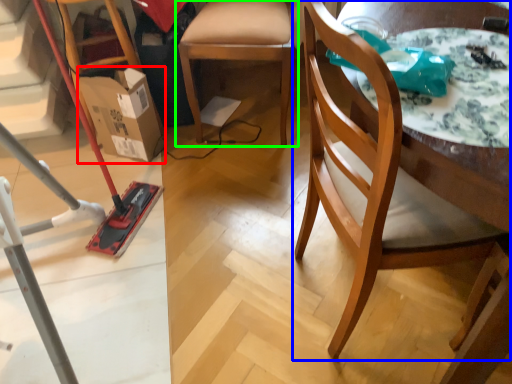
Question: Based on their relative distances, which object is farther from cardboard box (highlighted by a red box)? Choose from chair (highlighted by a blue box) and chair (highlighted by a green box).

Choices:
 (A) chair
 (B) chair

Answer: (A)